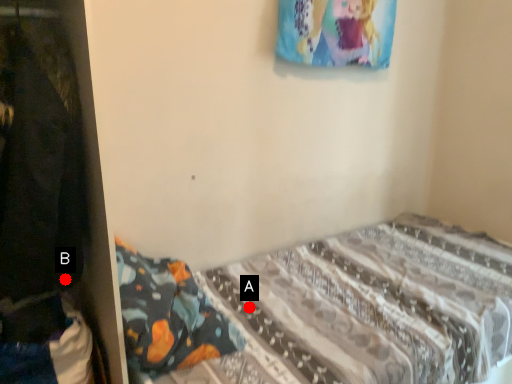
Question: Two points are circled on the image, labeled by A and B beside each circle. Which of the following is the closest to the observer?

Choices:
 (A) A is closer
 (B) B is closer

Answer: (B)